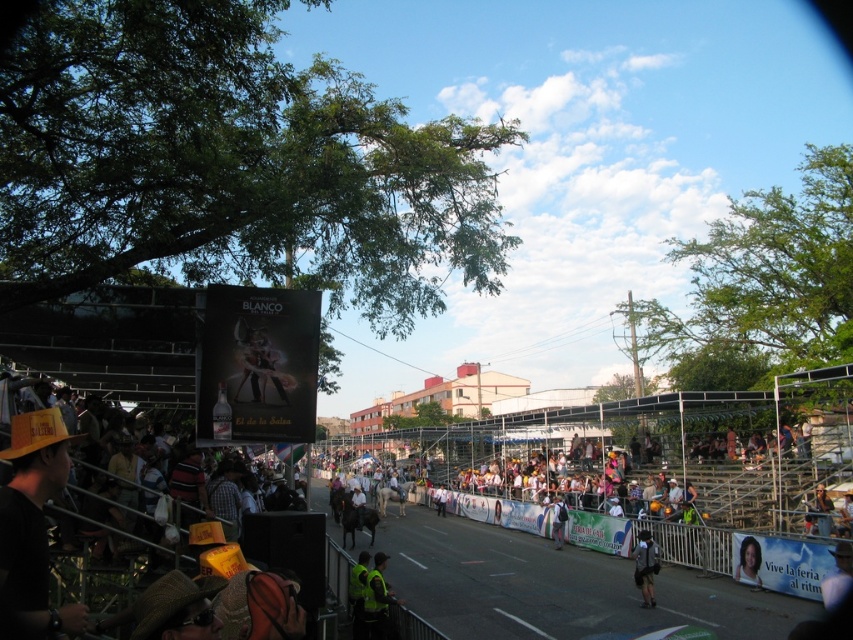
You are standing at the event and want to reach the point marked at coordinates [746,536]. If you walk directly towards it, how far will you have to walk?

The point marked at coordinates [746,536] is 53.11 meters away from you, so you will have to walk 53.11 meters to reach it.

Is the point at coordinate (x=747, y=561) located on the smooth skin portrait at center?

Yes, the point at coordinate (x=747, y=561) is located on the smooth skin portrait at center.

You are a delivery person trying to navigate through the event area. You need to move your dark blue backpack at center along the smooth asphalt road at center. Can you move it sideways without any obstruction?

The smooth asphalt road at center is wider than the dark blue backpack at center, so yes, you can move it sideways without obstruction.